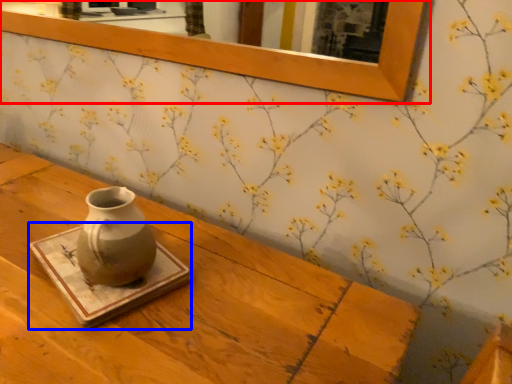
Question: Which point is further to the camera, picture frame (highlighted by a red box) or tray (highlighted by a blue box)?

Choices:
 (A) picture frame
 (B) tray

Answer: (A)